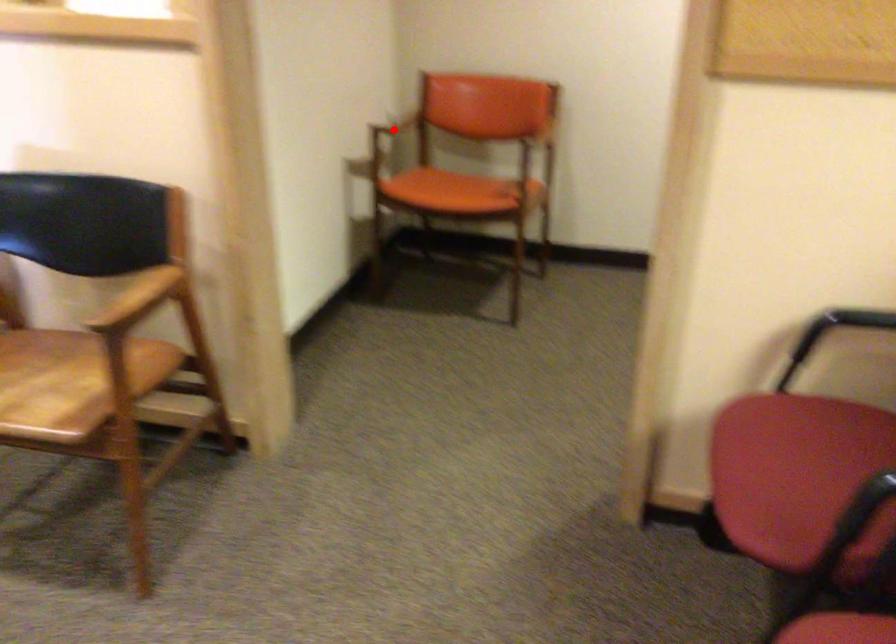
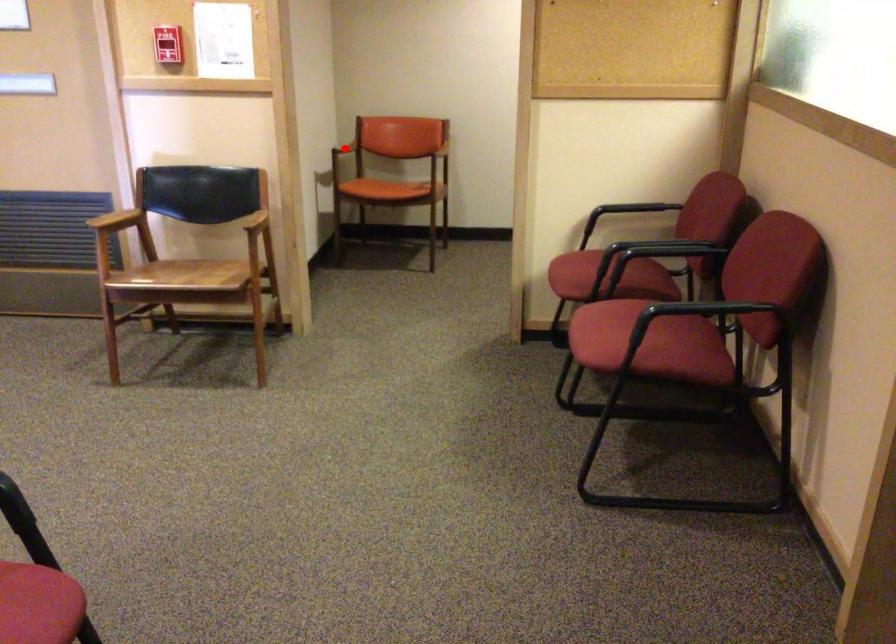
I am providing you with two images of the same scene from different viewpoints. A red point is marked on the first image and another point is marked on the second image. Are the points marked in image1 and image2 representing the same 3D position?

Yes